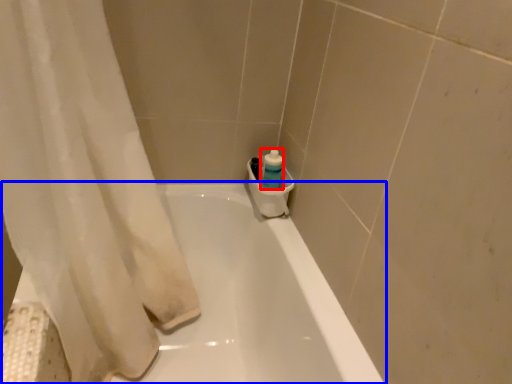
Question: Which object is further to the camera taking this photo, cleaning product (highlighted by a red box) or bathtub (highlighted by a blue box)?

Choices:
 (A) cleaning product
 (B) bathtub

Answer: (A)